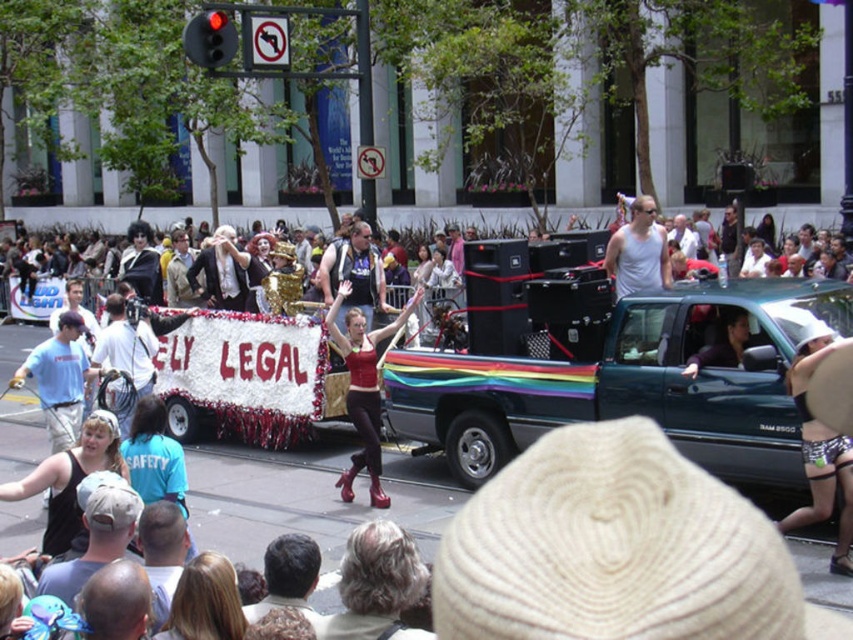
You are a photographer trying to capture the float in the parade. You notice two items in the scene that might distract from your shot. The matte black tank top at center and the shiny black wig at left. Which of these two items is closer to the camera, based on their relative heights?

The matte black tank top at center has a lesser height compared to the shiny black wig at left, so the matte black tank top at center is closer to the camera since it appears smaller in height.

You are a photographer at the parade and want to capture both the matte black tank top at center and the shiny black wig at left in the same frame. Which object should you position closer to the left side of your camera viewfinder?

You should position the shiny black wig at left closer to the left side of your camera viewfinder since it is located to the left of the matte black tank top at center.